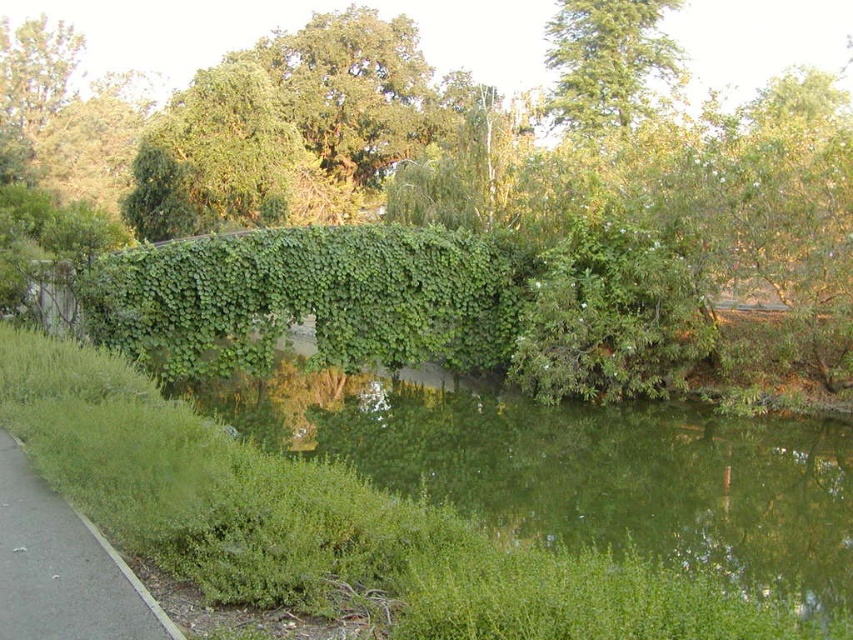
You are standing at the point with coordinates point (137, 262) and want to walk to the point with coordinates point (538, 413). According to the scene, will the dense hedge covered in vibrant green ivy block your path?

The point (538, 413) is behind the point (137, 262), so the dense hedge covered in vibrant green ivy would block your path to the point (538, 413).

You are standing at the point marked by the coordinates point (x=309, y=298), which is the green leafy hedge at center. Looking around, you see the paved pathway running parallel to the water. Which direction should you walk to reach the pathway?

The green leafy hedge at center is located at point (x=309, y=298). Since the pathway runs parallel to the water and the hedge is between the pathway and the water, you should walk away from the water towards the pathway.

You are standing on the paved pathway and want to walk towards the green grass at lower left. Which direction should you turn to avoid the green leafy hedge at center?

You should turn left to avoid the green leafy hedge at center, as the green leafy hedge at center is to the right of green grass at lower left.